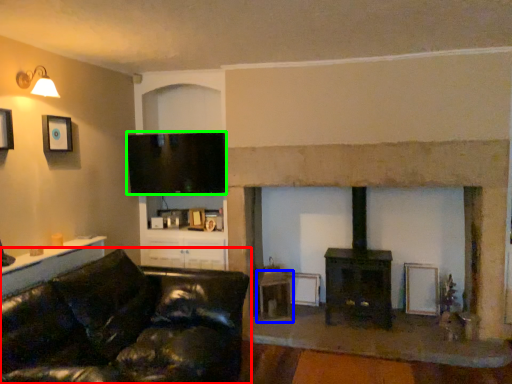
Question: Which object is positioned farthest from studio couch (highlighted by a red box)? Select from table (highlighted by a blue box) and television (highlighted by a green box).

Choices:
 (A) table
 (B) television

Answer: (A)